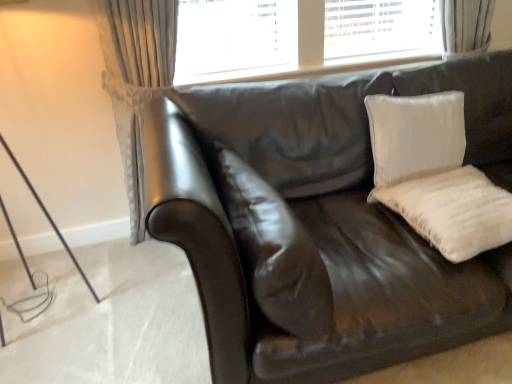
Question: Is white textured pillow at upper right, which ranks as the 2th pillow in right-to-left order, wider or thinner than white cotton pillow at right, which appears as the 1th pillow when viewed from the right?

Choices:
 (A) wide
 (B) thin

Answer: (B)

Question: From their relative heights in the image, would you say white textured pillow at upper right, acting as the 2th pillow starting from the left, is taller or shorter than white cotton pillow at right, which appears as the 1th pillow when viewed from the right?

Choices:
 (A) tall
 (B) short

Answer: (A)

Question: Based on their relative distances, which object is farther from the satin brown pillow at center, which ranks as the third pillow in right-to-left order?

Choices:
 (A) white cotton pillow at right, which appears as the 1th pillow when viewed from the right
 (B) shiny brown leather couch at center
 (C) white textured pillow at upper right, acting as the 2th pillow starting from the left

Answer: (C)

Question: Estimate the real-world distances between objects in this image. Which object is closer to the shiny brown leather couch at center?

Choices:
 (A) satin brown pillow at center, which ranks as the third pillow in right-to-left order
 (B) white cotton pillow at right, which appears as the 1th pillow when viewed from the right
 (C) white textured pillow at upper right, which ranks as the 2th pillow in right-to-left order

Answer: (A)